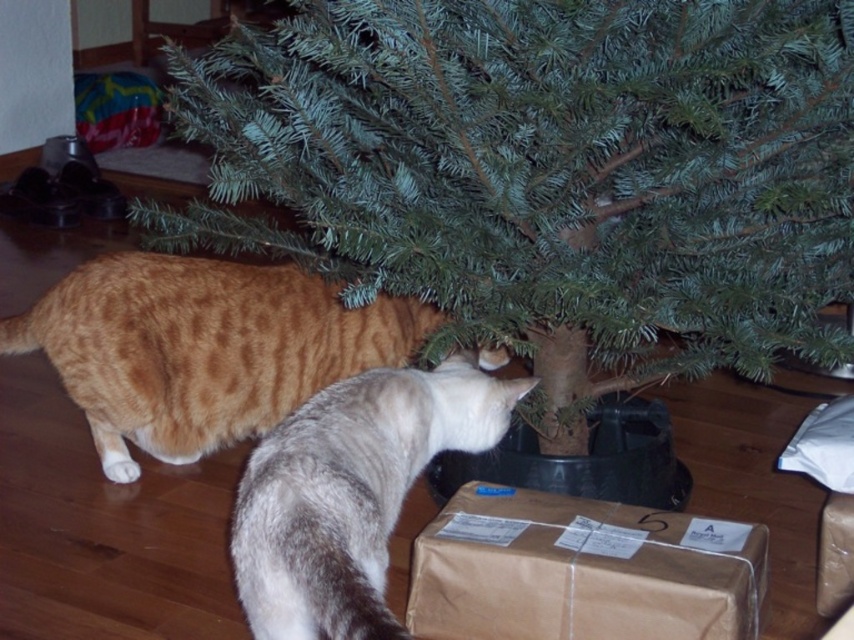
Question: Is green matte tree at center wider than gray fur cat at lower center?

Choices:
 (A) yes
 (B) no

Answer: (A)

Question: Which point is farther to the camera?

Choices:
 (A) (232, 371)
 (B) (399, 428)

Answer: (A)

Question: Can you confirm if orange tabby cat at lower left is positioned to the left of gray fur cat at lower center?

Choices:
 (A) no
 (B) yes

Answer: (B)

Question: Which point is closer to the camera?

Choices:
 (A) (325, 497)
 (B) (161, 237)

Answer: (A)

Question: Can you confirm if orange tabby cat at lower left is positioned above gray fur cat at lower center?

Choices:
 (A) no
 (B) yes

Answer: (B)

Question: Which object is farther from the camera taking this photo?

Choices:
 (A) orange tabby cat at lower left
 (B) green matte tree at center
 (C) gray fur cat at lower center

Answer: (A)